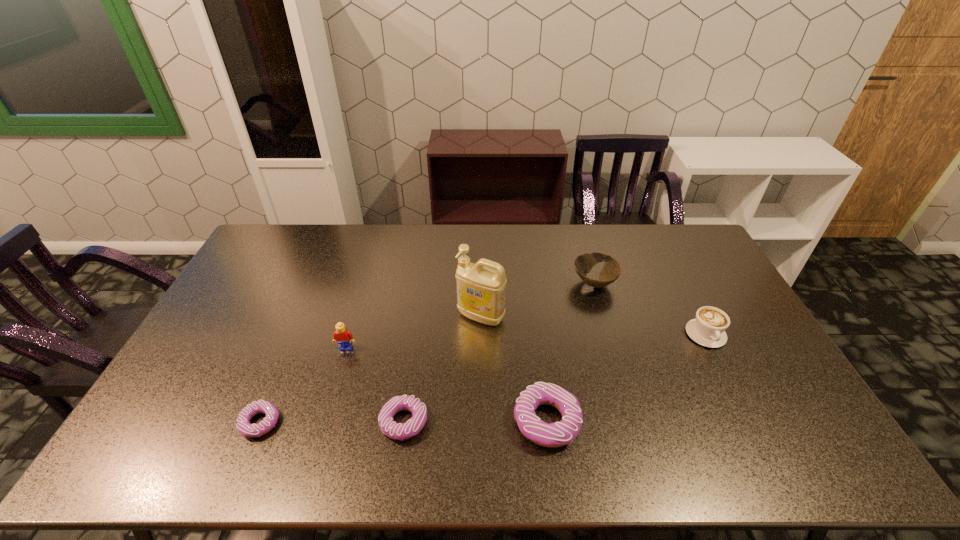
Locate an element on the screen. This screenshot has height=540, width=960. the leftmost doughnut is located at coordinates (243, 424).

At what (x,y) coordinates should I click in order to perform the action: click on the shortest doughnut. Please return your answer as a coordinate pair (x, y). This screenshot has width=960, height=540. Looking at the image, I should click on (243, 424).

You are a GUI agent. You are given a task and a screenshot of the screen. Output one action in this format:
    pyautogui.click(x=<x>, y=<y>)
    Task: Click on the second shortest object
    The height and width of the screenshot is (540, 960).
    Given the screenshot: What is the action you would take?
    pyautogui.click(x=400, y=431)

This screenshot has width=960, height=540. Find the location of `the second doughnut from left to right`. the second doughnut from left to right is located at coordinates (400, 431).

Where is `the fifth object from left to right`? the fifth object from left to right is located at coordinates (561, 433).

Locate an element on the screen. the rightmost doughnut is located at coordinates (561, 433).

Locate an element on the screen. This screenshot has width=960, height=540. the farthest object is located at coordinates tap(583, 263).

What are the coordinates of `bowl` in the screenshot? It's located at (583, 263).

Locate an element on the screen. The height and width of the screenshot is (540, 960). the fourth object from left to right is located at coordinates click(481, 287).

This screenshot has width=960, height=540. Find the location of `the tallest object`. the tallest object is located at coordinates (481, 287).